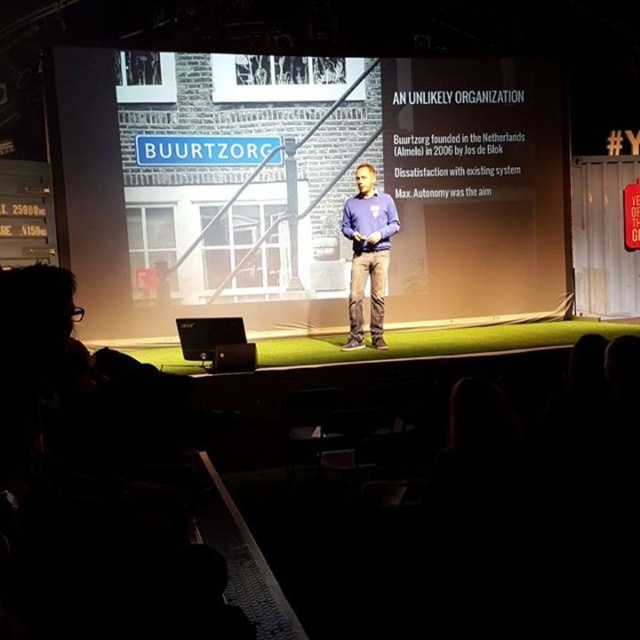
Does purple sweater at center have a smaller size compared to matte black laptop at center?

No.

What do you see at coordinates (368, 253) in the screenshot?
I see `purple sweater at center` at bounding box center [368, 253].

Does point (381, 218) come in front of point (237, 362)?

No, (381, 218) is behind (237, 362).

Image resolution: width=640 pixels, height=640 pixels. What are the coordinates of `purple sweater at center` in the screenshot? It's located at (368, 253).

Who is more forward, (438, 253) or (358, 198)?

Positioned in front is point (358, 198).

This screenshot has width=640, height=640. In order to click on white matte projection screen at center in this screenshot , I will do `click(474, 186)`.

The image size is (640, 640). What do you see at coordinates (474, 186) in the screenshot?
I see `white matte projection screen at center` at bounding box center [474, 186].

You are a GUI agent. You are given a task and a screenshot of the screen. Output one action in this format:
    pyautogui.click(x=<x>, y=<y>)
    Task: Click on the white matte projection screen at center
    The width and height of the screenshot is (640, 640).
    Given the screenshot: What is the action you would take?
    pyautogui.click(x=474, y=186)

Locate an element on the screen. white matte projection screen at center is located at coordinates (474, 186).